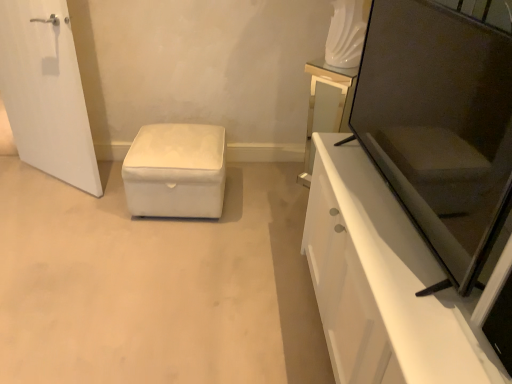
Question: Considering the relative positions of matte black screen door at right and matte glass vanity at upper right in the image provided, is matte black screen door at right to the left or to the right of matte glass vanity at upper right?

Choices:
 (A) right
 (B) left

Answer: (B)

Question: Considering the positions of matte black screen door at right and matte glass vanity at upper right in the image, is matte black screen door at right bigger or smaller than matte glass vanity at upper right?

Choices:
 (A) big
 (B) small

Answer: (B)

Question: Estimate the real-world distances between objects in this image. Which object is closer to the matte glass vanity at upper right?

Choices:
 (A) matte black screen door at right
 (B) white glossy cabinet at right
 (C) white fabric ottoman at center

Answer: (A)

Question: Which of these objects is positioned closest to the matte black screen door at right?

Choices:
 (A) white fabric ottoman at center
 (B) white glossy cabinet at right
 (C) matte glass vanity at upper right

Answer: (B)